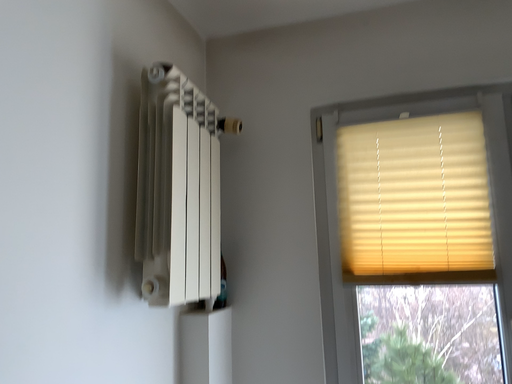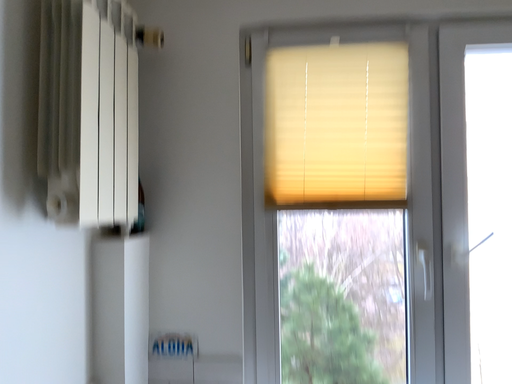
Question: Which way did the camera rotate in the video?

Choices:
 (A) rotated right
 (B) rotated left

Answer: (A)